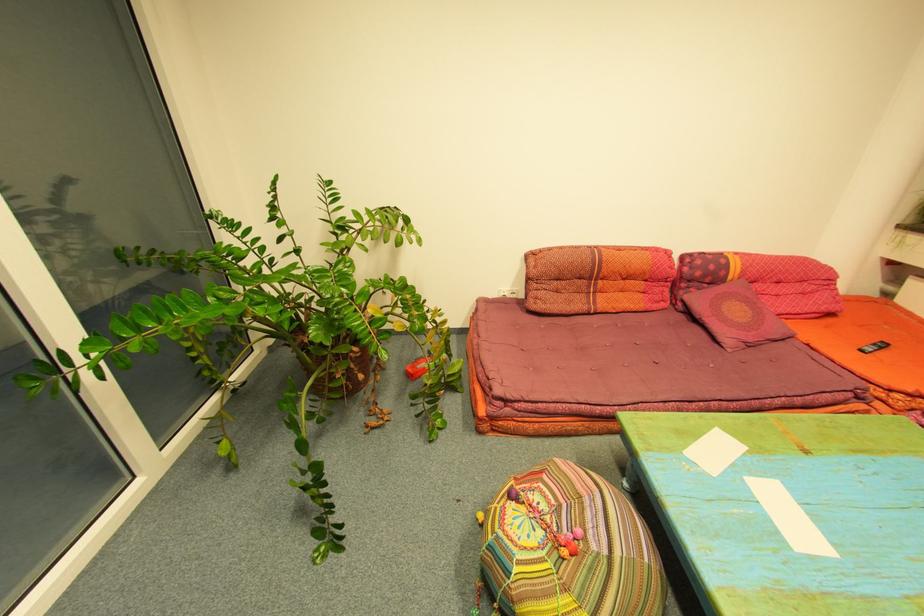
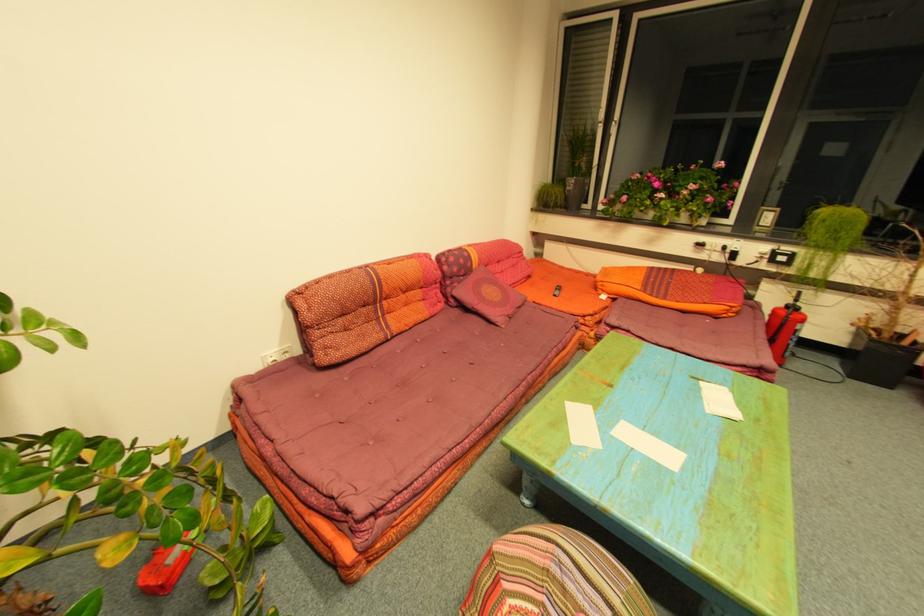
Question: The camera is either moving clockwise (left) or counter-clockwise (right) around the object. The first image is from the beginning of the video and the second image is from the end. Is the camera moving left or right when shooting the video?

Choices:
 (A) Left
 (B) Right

Answer: (A)